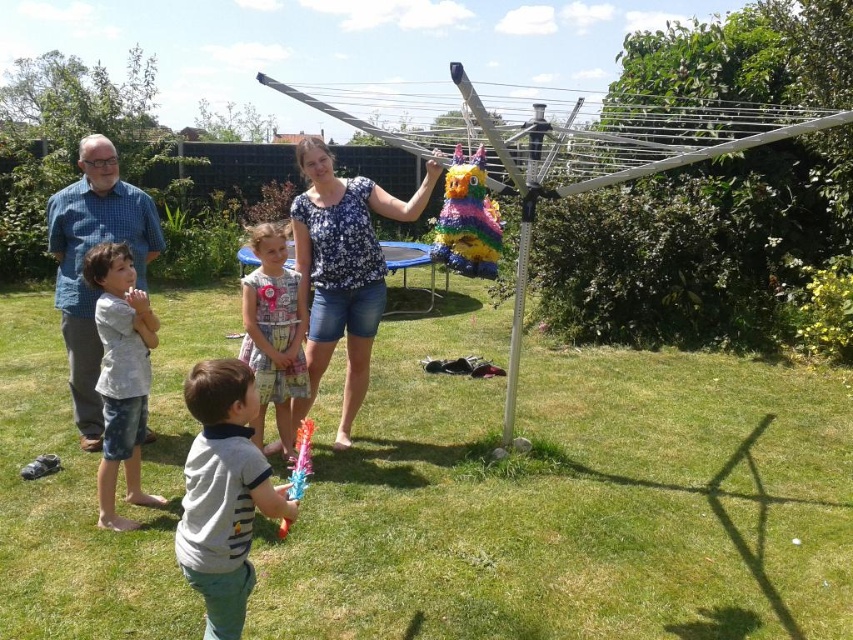
Where is `floral blouse at center`? This screenshot has width=853, height=640. floral blouse at center is located at coordinates (341, 269).

Can you confirm if floral blouse at center is positioned above gray cotton shirt at center?

Correct, floral blouse at center is located above gray cotton shirt at center.

Is point (357, 225) closer to camera compared to point (201, 406)?

No.

Find the location of `floral blouse at center`. floral blouse at center is located at coordinates (341, 269).

Does blue checkered shirt at left have a lesser height compared to translucent plastic pinata at center?

In fact, blue checkered shirt at left may be taller than translucent plastic pinata at center.

Is point (73, 403) closer to camera compared to point (306, 452)?

That is False.

Find the location of a particular element. This screenshot has height=640, width=853. blue checkered shirt at left is located at coordinates (82, 260).

Does gray cotton shirt at center lie in front of translucent plastic pinata at center?

Yes, gray cotton shirt at center is in front of translucent plastic pinata at center.

Which is more to the left, gray cotton shirt at center or translucent plastic pinata at center?

gray cotton shirt at center is more to the left.

Locate an element on the screen. gray cotton shirt at center is located at coordinates (223, 493).